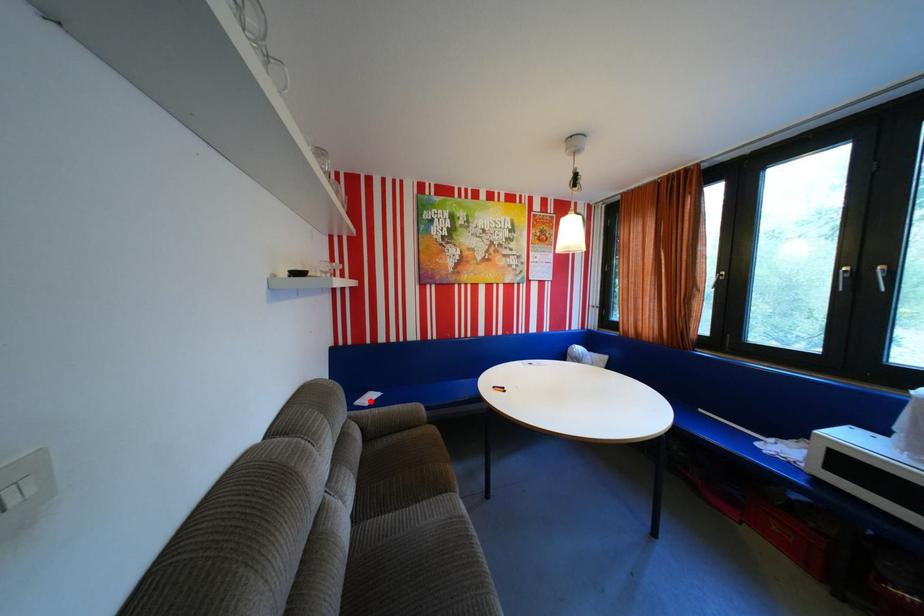
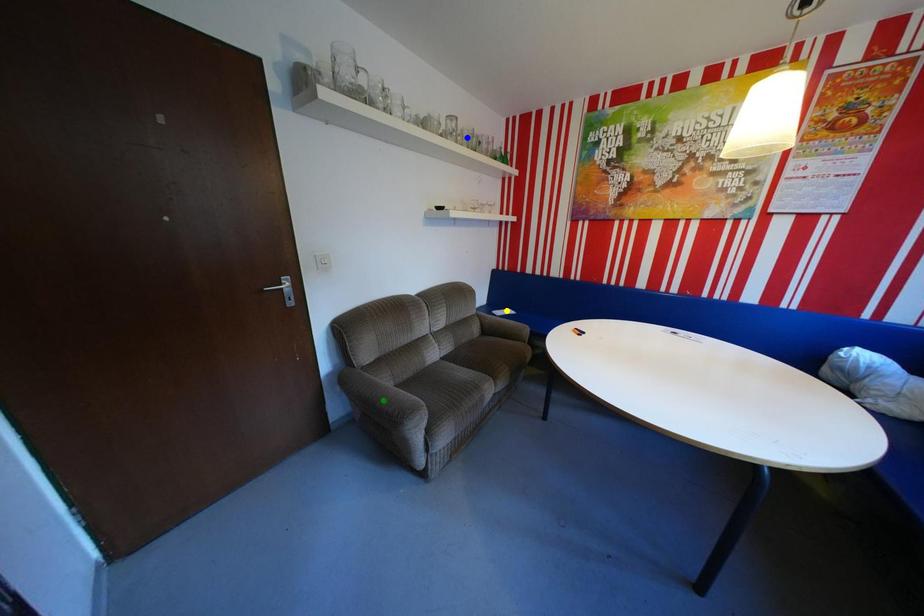
Question: I am providing you with two images of the same scene from different viewpoints. A red point is marked on the first image. You are given multiple points on the second image. Can you choose the point in image 2 that corresponds to the point in image 1?

Choices:
 (A) blue point
 (B) green point
 (C) yellow point

Answer: (C)